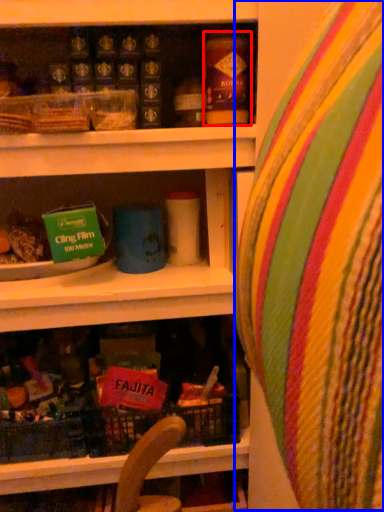
Question: Among these objects, which one is nearest to the camera, yoghurt (highlighted by a red box) or bean bag chair (highlighted by a blue box)?

Choices:
 (A) yoghurt
 (B) bean bag chair

Answer: (B)